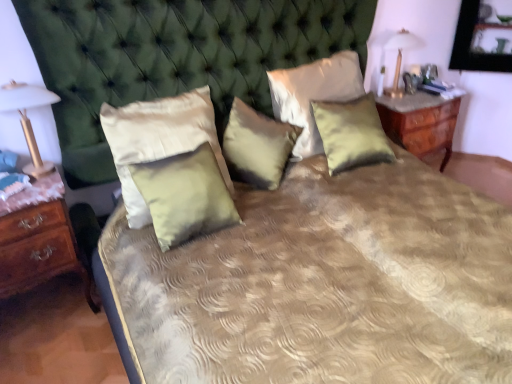
Where is `free point below gold metallic lampshade at upper right, which is counted as the second bedside lamp, starting from the bottom (from a real-world perspective)`? free point below gold metallic lampshade at upper right, which is counted as the second bedside lamp, starting from the bottom (from a real-world perspective) is located at coordinates (394, 96).